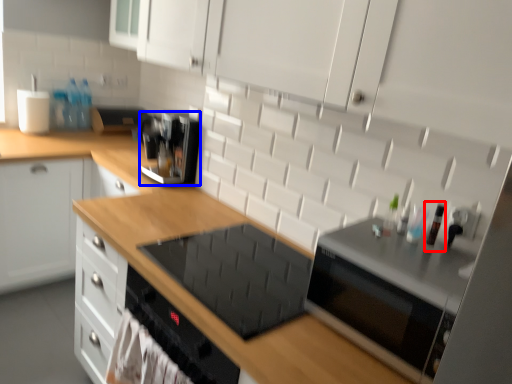
Question: Which object appears farthest to the camera in this image, bottle (highlighted by a red box) or kitchen appliance (highlighted by a blue box)?

Choices:
 (A) bottle
 (B) kitchen appliance

Answer: (B)